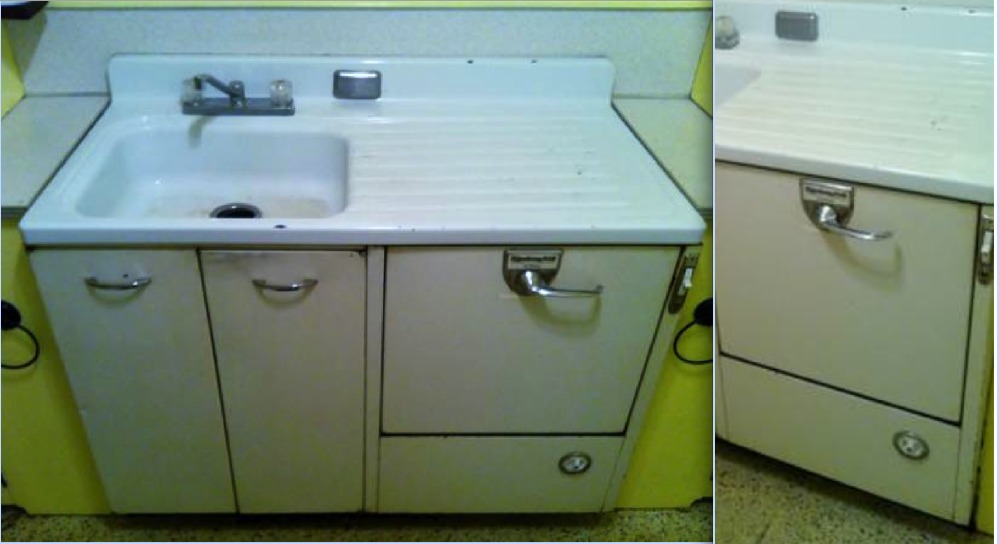
You are a GUI agent. You are given a task and a screenshot of the screen. Output one action in this format:
    pyautogui.click(x=<x>, y=<y>)
    Task: Click on the handle
    The image size is (999, 544).
    Given the screenshot: What is the action you would take?
    coord(561,285)